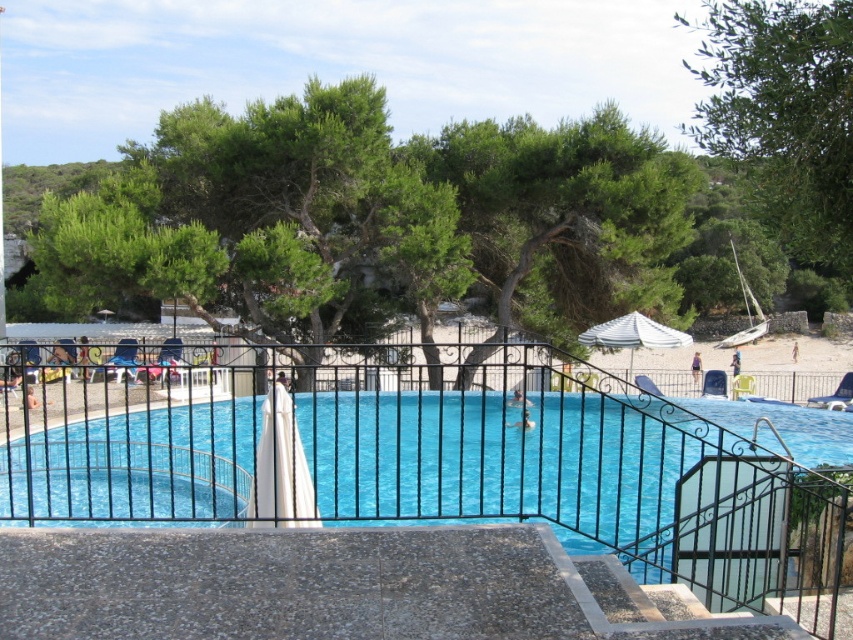
You are standing at the edge of the pool and see the blue glossy water at center and the green leafy tree at center. Which object is positioned to the right of the other?

The blue glossy water at center is to the right of green leafy tree at center.

You are a photographer standing at the edge of the pool. You want to capture a photo that includes both the blue glossy water at center and the green leafy tree at center. Which object should you position closer to the foreground to ensure both are in focus?

The blue glossy water at center has a lesser height compared to the green leafy tree at center. To ensure both are in focus, position the blue glossy water at center closer to the foreground since it is shorter, allowing the tree to be in the background without losing focus.

Looking at this image, you are planning to install a new bench in the pool area and want to ensure it is placed exactly halfway between the green leafy tree at center and the green leafy tree at upper right. What distance should you measure from each tree to place the bench correctly?

The distance between the green leafy tree at center and the green leafy tree at upper right is 11.93 meters. To place the bench exactly halfway, you should measure 5.965 meters from each tree.